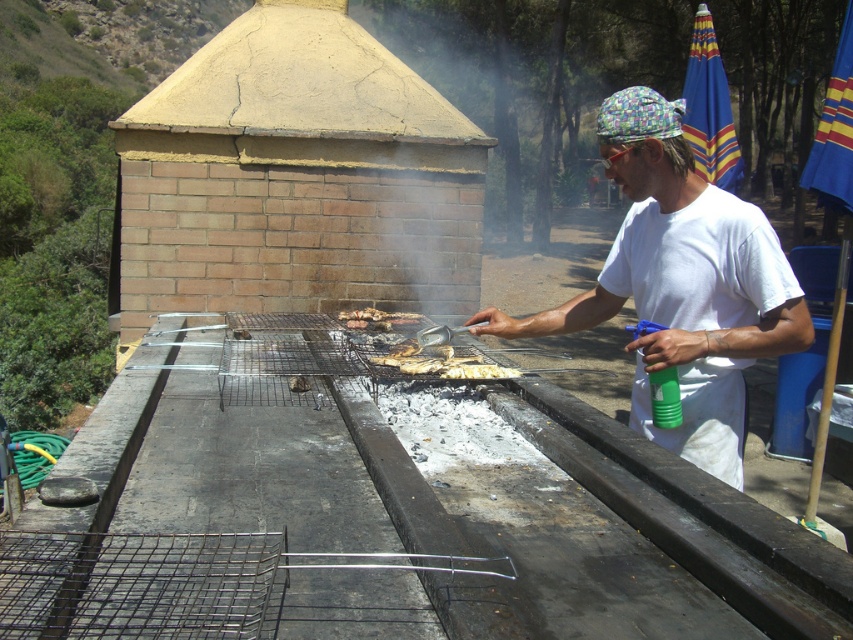
You are standing in the barbecue area and want to place a new grill mat. You have two options to choose from. One is placed at point [724,324] and the other at point [412,317]. Which point is closer to you?

Point [724,324] is closer to the viewer than point [412,317], so you should choose the one at point [724,324].

You are planning to take a photo of the barbecue scene. The photographer wants to ensure the white cotton shirt at center is visible in the frame. Given the current composition, where should the camera be positioned relative to the grill and the brick structure to include both the shirt and the brick structure in the shot?

The white cotton shirt at center is located at point (682, 284). To include both the shirt and the brick structure in the frame, position the camera centrally between the grill and the brick structure, ensuring the shirt remains centered while framing the background structure.

You are a guest at the barbecue and want to grab the charcoal briquettes at center without touching the white cotton shirt at center. Can you reach them easily?

The white cotton shirt at center is positioned on the right side of charcoal briquettes at center, so you can reach the charcoal briquettes at center by moving your hand to the left side of the white cotton shirt at center. However, since both items are at the center, you need to be cautious to avoid contact with the shirt.